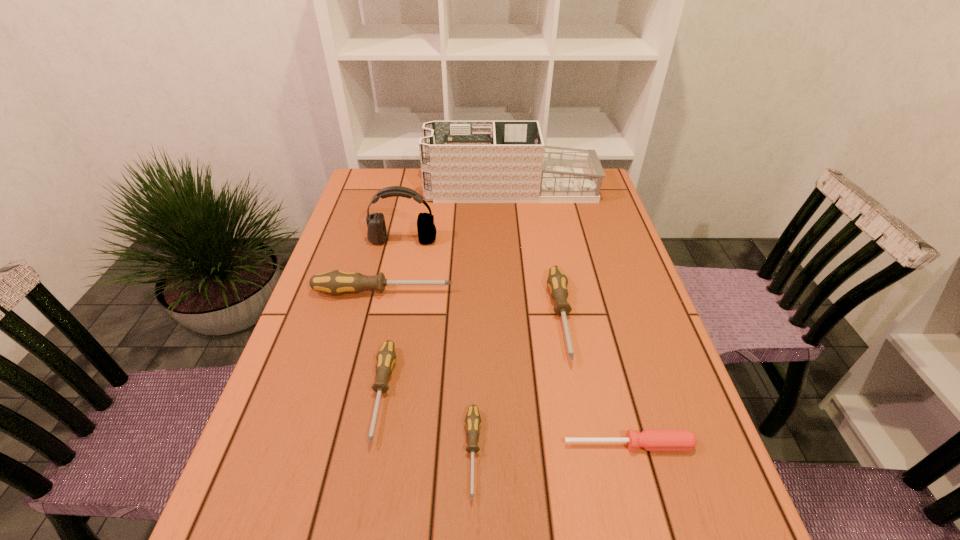
At what (x,y) coordinates should I click in order to perform the action: click on the smallest gray screwdriver. Please return your answer as a coordinate pair (x, y). Looking at the image, I should click on (472, 420).

Where is `the third gray screwdriver from left to right`? the third gray screwdriver from left to right is located at coordinates (472, 420).

In order to click on free location located 0.240m at the entrance of the farthest object in this screenshot , I will do `click(355, 188)`.

Find the location of a particular element. The image size is (960, 540). free space located at the entrance of the farthest object is located at coordinates (382, 188).

Identify the location of vacant area situated at the entrance of the farthest object. The image size is (960, 540). tap(371, 188).

You are a GUI agent. You are given a task and a screenshot of the screen. Output one action in this format:
    pyautogui.click(x=<x>, y=<y>)
    Task: Click on the vacant region located on the headband of the second farthest object
    
    Given the screenshot: What is the action you would take?
    pyautogui.click(x=384, y=330)

Find the location of a particular element. vacant area located 0.170m at the tip of the third tallest object is located at coordinates (520, 292).

Identify the location of free region located 0.330m at the tip of the fourth shortest screwdriver. (602, 537).

Where is `vacant space located at the tip of the fifth tallest object`? vacant space located at the tip of the fifth tallest object is located at coordinates (358, 519).

At what (x,y) coordinates should I click in order to perform the action: click on blank space located on the back of the red screwdriver. Please return your answer as a coordinate pair (x, y). This screenshot has width=960, height=540. Looking at the image, I should click on (602, 342).